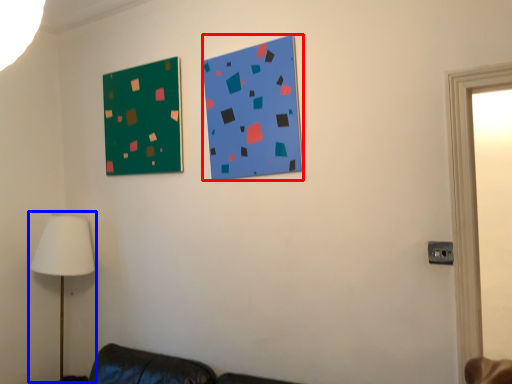
Question: Among these objects, which one is nearest to the camera, bulletin board (highlighted by a red box) or table lamp (highlighted by a blue box)?

Choices:
 (A) bulletin board
 (B) table lamp

Answer: (A)